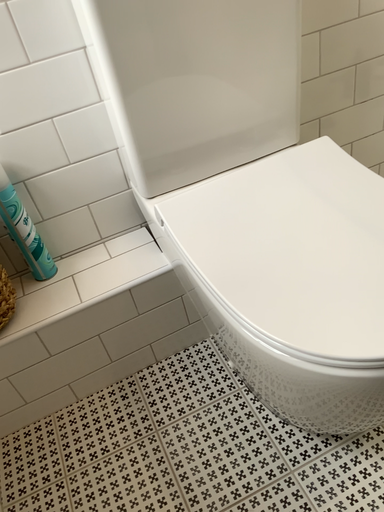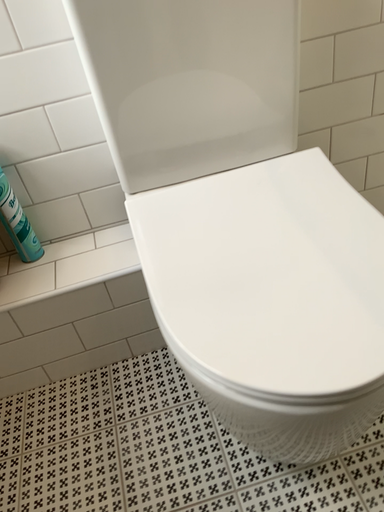
Question: How did the camera likely rotate when shooting the video?

Choices:
 (A) rotated left
 (B) rotated right

Answer: (A)